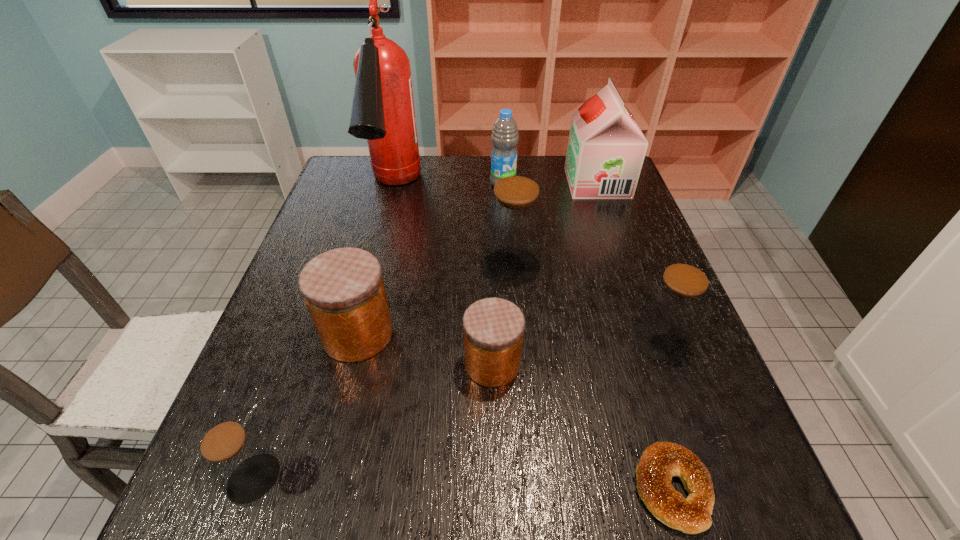
This screenshot has width=960, height=540. In order to click on the tallest object in this screenshot , I will do `click(383, 112)`.

At what (x,y) coordinates should I click in order to perform the action: click on fire extinguisher. Please return your answer as a coordinate pair (x, y). The height and width of the screenshot is (540, 960). Looking at the image, I should click on (383, 112).

Identify the location of soya milk. The width and height of the screenshot is (960, 540). (606, 148).

Locate an element on the screen. blue water bottle is located at coordinates (504, 137).

At what (x,y) coordinates should I click in order to perform the action: click on the farthest jar. Please return your answer as a coordinate pair (x, y). Looking at the image, I should click on (514, 220).

Find the location of a particular element. The width and height of the screenshot is (960, 540). the second brown jar from right to left is located at coordinates pos(514,220).

Locate an element on the screen. The height and width of the screenshot is (540, 960). the bigger orange jar is located at coordinates (344, 291).

Find the location of a particular element. The height and width of the screenshot is (540, 960). the second biggest brown jar is located at coordinates (675, 304).

In order to click on the rightmost jar in this screenshot , I will do `click(675, 304)`.

Locate an element on the screen. the smaller orange jar is located at coordinates (493, 328).